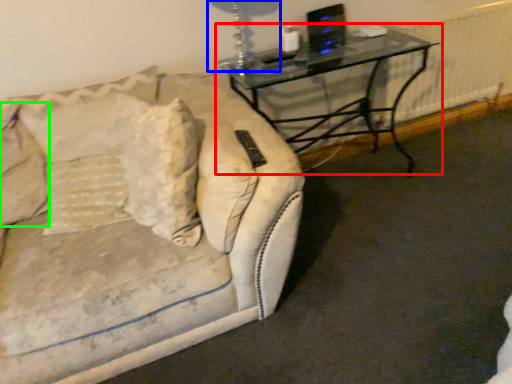
Question: Which object is the farthest from table (highlighted by a red box)? Choose among these: table lamp (highlighted by a blue box) or pillow (highlighted by a green box).

Choices:
 (A) table lamp
 (B) pillow

Answer: (B)